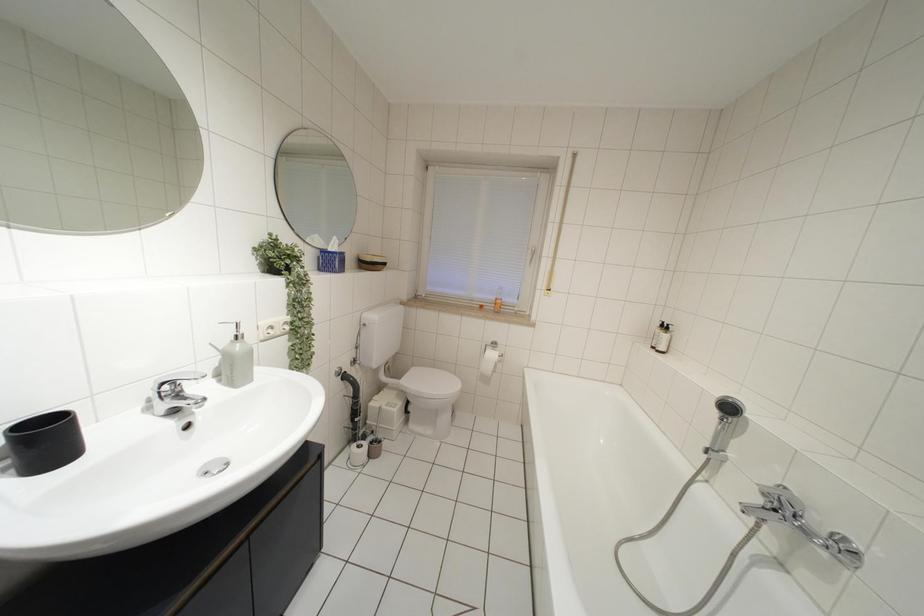
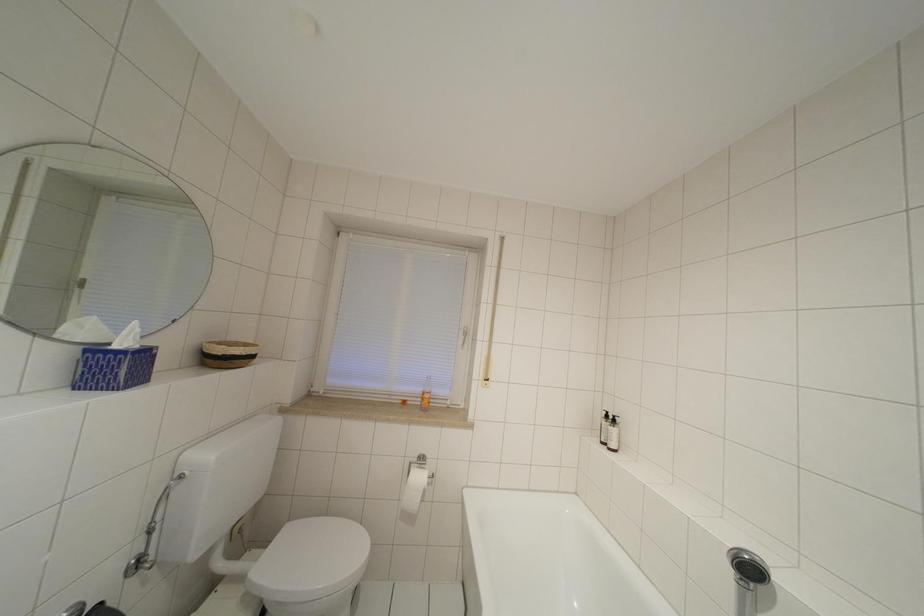
Question: How did the camera likely rotate?

Choices:
 (A) Left
 (B) Right
 (C) Up
 (D) Down

Answer: (B)